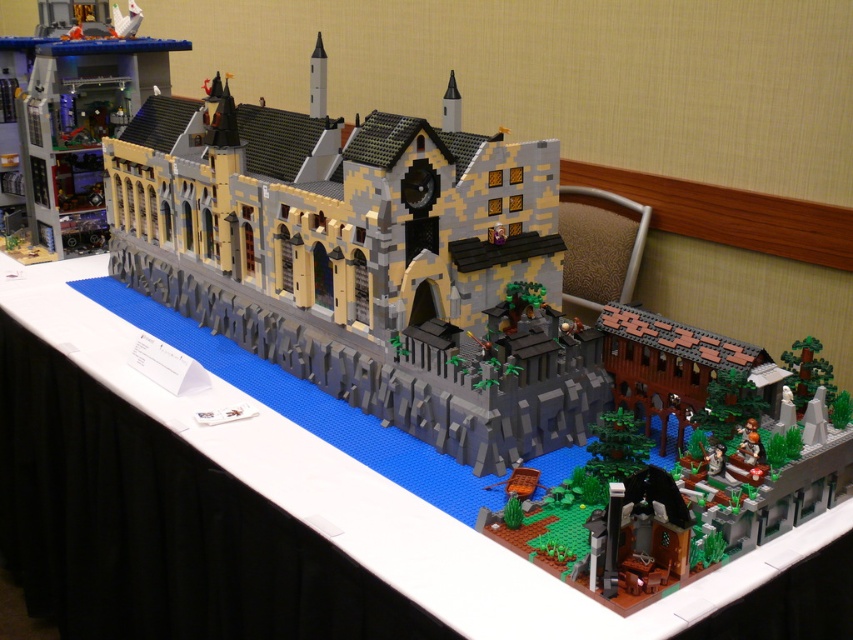
Consider the image. Does smooth plastic castle at upper left come behind brown textured building at lower right?

Yes, it is behind brown textured building at lower right.

Who is positioned more to the right, smooth plastic castle at upper left or brown textured building at lower right?

brown textured building at lower right is more to the right.

You are a GUI agent. You are given a task and a screenshot of the screen. Output one action in this format:
    pyautogui.click(x=<x>, y=<y>)
    Task: Click on the smooth plastic castle at upper left
    The width and height of the screenshot is (853, 640).
    Given the screenshot: What is the action you would take?
    pyautogui.click(x=68, y=120)

Is point (444, 272) positioned behind point (569, 588)?

Yes, it is.

This screenshot has width=853, height=640. I want to click on brick gray castle at center, so click(361, 259).

Can you confirm if white matte table at center is positioned above brown textured building at lower right?

Yes, white matte table at center is above brown textured building at lower right.

Does white matte table at center appear on the left side of brown textured building at lower right?

Correct, you'll find white matte table at center to the left of brown textured building at lower right.

Which is behind, point (695, 580) or point (614, 400)?

The point (614, 400) is more distant.

Locate an element on the screen. The width and height of the screenshot is (853, 640). white matte table at center is located at coordinates (374, 492).